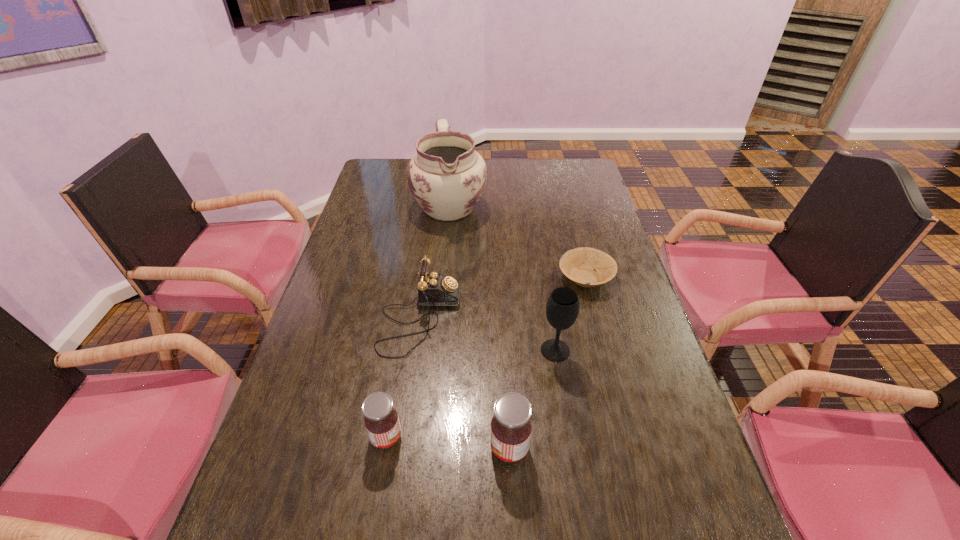
I want to click on blank area at the far edge, so click(x=523, y=171).

This screenshot has width=960, height=540. Identify the location of vacant space at the left edge of the desktop. (366, 190).

This screenshot has height=540, width=960. In the image, there is a desktop. Find the location of `vacant space at the right edge`. vacant space at the right edge is located at coordinates (613, 253).

Where is `vacant region between the telephone and the second tallest object`? The image size is (960, 540). vacant region between the telephone and the second tallest object is located at coordinates (488, 334).

Where is `vacant area between the third tallest object and the pitcher`? vacant area between the third tallest object and the pitcher is located at coordinates (479, 327).

At what (x,y) coordinates should I click in order to perform the action: click on empty location between the second tallest object and the right jam. Please return your answer as a coordinate pair (x, y). Looking at the image, I should click on (532, 400).

You are a GUI agent. You are given a task and a screenshot of the screen. Output one action in this format:
    pyautogui.click(x=<x>, y=<y>)
    Task: Click on the free space between the bowl and the telephone
    This screenshot has height=540, width=960.
    Given the screenshot: What is the action you would take?
    pyautogui.click(x=503, y=298)

Locate an element on the screen. empty space between the telephone and the right jam is located at coordinates (465, 383).

Locate an element on the screen. The width and height of the screenshot is (960, 540). empty space between the rightmost object and the right jam is located at coordinates (547, 363).

You are a GUI agent. You are given a task and a screenshot of the screen. Output one action in this format:
    pyautogui.click(x=<x>, y=<y>)
    Task: Click on the empty space between the taller jam and the farthest object
    This screenshot has height=540, width=960.
    Given the screenshot: What is the action you would take?
    pyautogui.click(x=479, y=327)